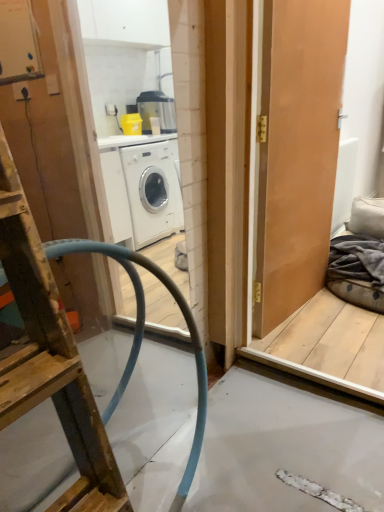
Question: Is dark grey fabric at right taller or shorter than wooden ladder at left?

Choices:
 (A) short
 (B) tall

Answer: (A)

Question: Considering the positions of dark grey fabric at right and wooden ladder at left in the image, is dark grey fabric at right bigger or smaller than wooden ladder at left?

Choices:
 (A) small
 (B) big

Answer: (A)

Question: Considering the real-world distances, which object is closest to the dark grey fabric at right?

Choices:
 (A) matte wooden door at right
 (B) wooden ladder at left

Answer: (A)

Question: Which is nearer to the dark grey fabric at right?

Choices:
 (A) wooden ladder at left
 (B) matte wooden door at right

Answer: (B)